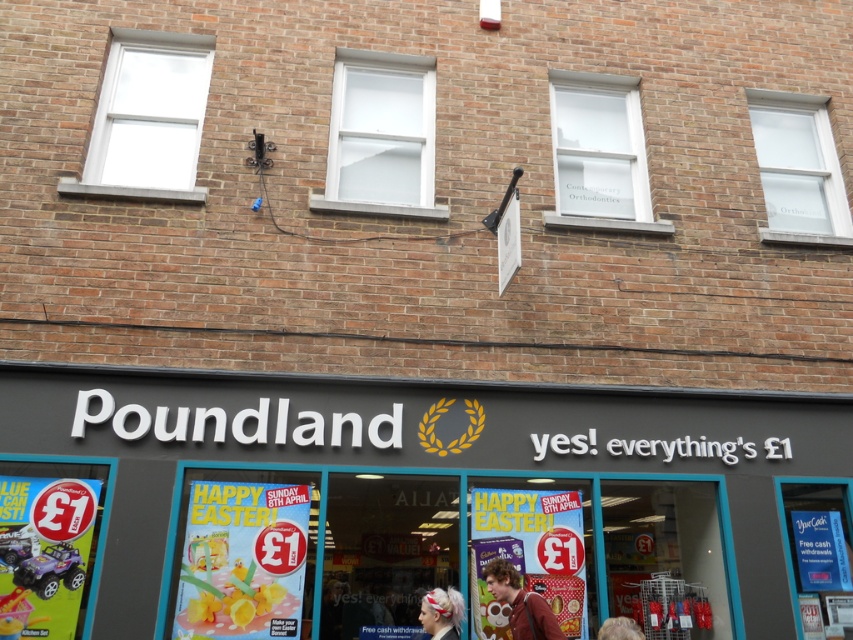
Question: Among these objects, which one is farthest from the camera?

Choices:
 (A) black matte poundland sign at center
 (B) brown leather jacket at center
 (C) transparent glass window at upper right

Answer: (C)

Question: Can you confirm if black matte poundland sign at center is positioned above white matte hairband at lower center?

Choices:
 (A) yes
 (B) no

Answer: (A)

Question: Which is farther from the black matte poundland sign at center?

Choices:
 (A) transparent glass window at upper right
 (B) blonde hair at lower center
 (C) white glass window at center
 (D) white matte hairband at lower center

Answer: (A)

Question: Is black matte poundland sign at center closer to camera compared to white matte hairband at lower center?

Choices:
 (A) yes
 (B) no

Answer: (B)

Question: Which of the following is the farthest from the observer?

Choices:
 (A) (131, 118)
 (B) (828, 195)
 (C) (489, 572)

Answer: (B)

Question: Is transparent glass window at center to the right of white matte hairband at lower center from the viewer's perspective?

Choices:
 (A) yes
 (B) no

Answer: (A)